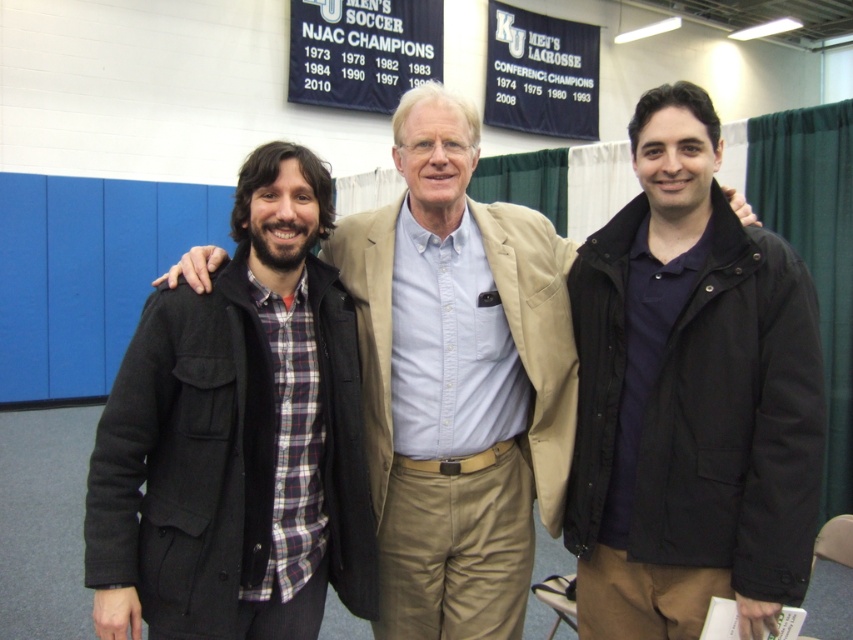
You are a photographer at the event and need to adjust your camera to focus on both the matte black coat at left and the plaid shirt at center. Since the camera can only focus on one depth level at a time, which object should you prioritize focusing on to ensure at least one is in focus?

The matte black coat at left is located below plaid shirt at center, so focusing on the plaid shirt at center would ensure it is in focus, and the matte black coat at left may also be in focus depending on the camera settings. However, prioritizing the plaid shirt at center ensures that the closer object is sharp.